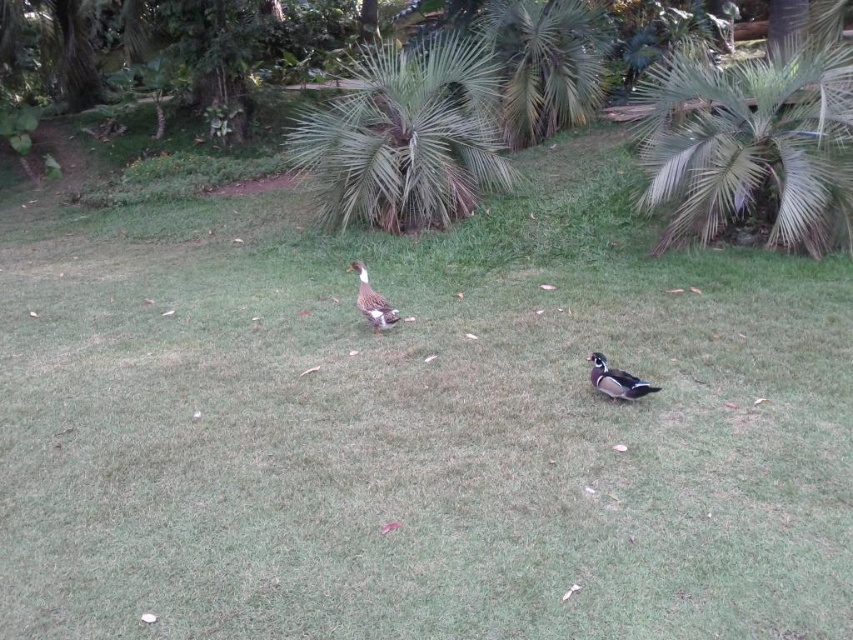
You are a bird looking for a place to perch. You see the green leafy palm at upper right and the green leafy palm tree at upper center. Which one offers a larger perch area?

The green leafy palm at upper right is bigger than the green leafy palm tree at upper center, so it offers a larger perch area.

You are a gardener planning to install a small pathway between the green leafy palm at upper right and the green leafy palm tree at upper center. The pathway is 10 feet long. Will the pathway fit between them?

The distance between the green leafy palm at upper right and the green leafy palm tree at upper center is 9.91 feet, so a 10 feet pathway would be slightly too long to fit between them.

You are a bird flying over the scene and want to land on the tallest palm tree. Which one should you choose between the green leafy palm at upper right and the green leafy palm tree at center?

The green leafy palm tree at center is taller than the green leafy palm at upper right, so you should choose the green leafy palm tree at center to land on.